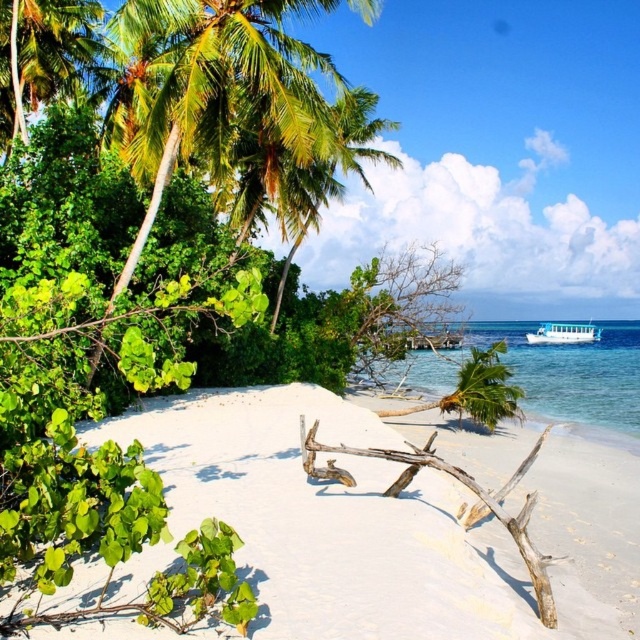
Question: Which object appears closest to the camera in this image?

Choices:
 (A) brown driftwood at center
 (B) green leafy palm tree at upper left
 (C) clear blue water at lower right
 (D) white sandy beach at center

Answer: (D)

Question: Which object is farther from the camera taking this photo?

Choices:
 (A) green leafy palm tree at upper left
 (B) white sandy beach at center
 (C) clear blue water at lower right

Answer: (A)

Question: Observing the image, what is the correct spatial positioning of white sandy beach at center in reference to white glossy boat at upper right?

Choices:
 (A) right
 (B) left

Answer: (B)

Question: Is clear blue water at lower right below brown driftwood at center?

Choices:
 (A) yes
 (B) no

Answer: (B)

Question: Does white sandy beach at center have a greater width compared to green leafy palm tree at upper left?

Choices:
 (A) yes
 (B) no

Answer: (A)

Question: Among these points, which one is nearest to the camera?

Choices:
 (A) (387, 483)
 (B) (83, 67)
 (C) (545, 340)

Answer: (A)